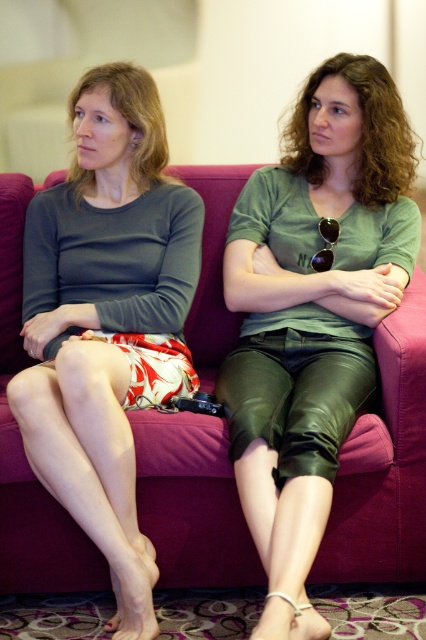
You are a photographer adjusting your camera settings. You notice the green leather pants at center and the matte gray skirt at left in your frame. Which clothing item is positioned higher in the image?

The green leather pants at center is located above the matte gray skirt at left, so it is positioned higher in the image.